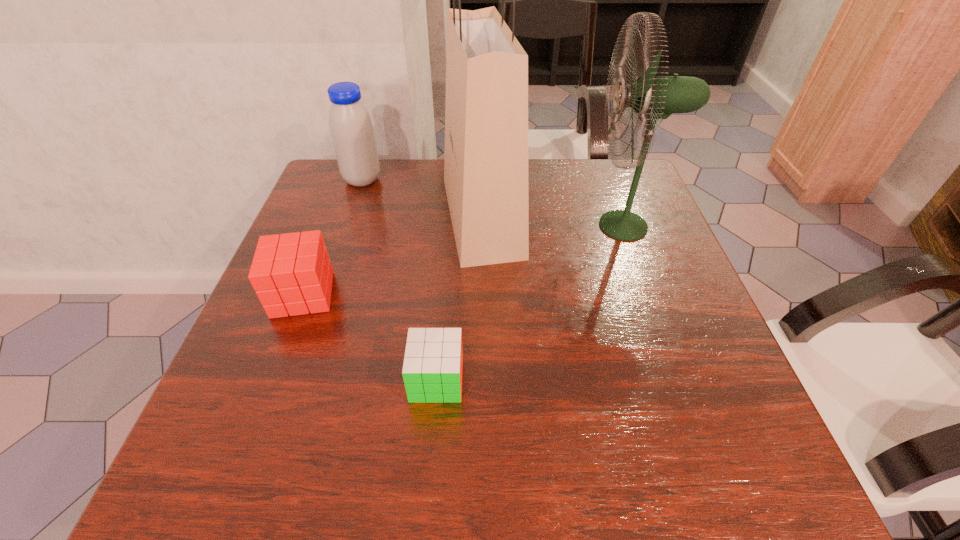
Find the location of a particular element. This screenshot has height=540, width=960. free space located 0.150m on the front-facing side of the fan is located at coordinates (526, 226).

This screenshot has width=960, height=540. What are the coordinates of `free location located on the front of the soya milk` in the screenshot? It's located at (344, 235).

Where is `vacant space located 0.150m on the right of the fourth tallest object`? The image size is (960, 540). vacant space located 0.150m on the right of the fourth tallest object is located at coordinates (410, 294).

At what (x,y) coordinates should I click in order to perform the action: click on vacant region located on the right of the shortest object. Please return your answer as a coordinate pair (x, y). This screenshot has width=960, height=540. Looking at the image, I should click on pos(628,380).

Locate an element on the screen. This screenshot has width=960, height=540. shopping bag situated at the far edge is located at coordinates (486, 110).

Locate an element on the screen. Image resolution: width=960 pixels, height=540 pixels. fan that is at the far edge is located at coordinates (652, 97).

Image resolution: width=960 pixels, height=540 pixels. I want to click on soya milk at the far edge, so click(351, 129).

The height and width of the screenshot is (540, 960). Identify the location of soya milk located at the left edge. (351, 129).

Locate an element on the screen. cube located at the left edge is located at coordinates (291, 273).

At what (x,y) coordinates should I click in order to perform the action: click on object at the right edge. Please return your answer as a coordinate pair (x, y). Looking at the image, I should click on (652, 97).